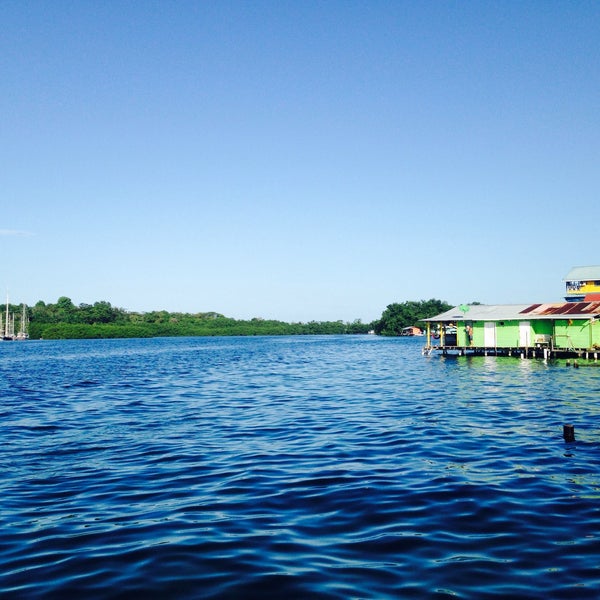
Find the location of a particular element. The image size is (600, 600). doors is located at coordinates (489, 337), (521, 335).